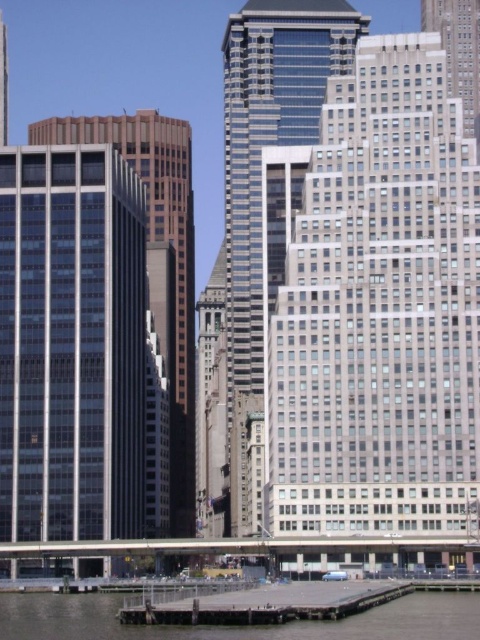
Find the location of a particular element. The image size is (480, 640). wooden dock at lower center is located at coordinates (267, 605).

Can you confirm if wooden dock at lower center is shorter than smooth brown building at left?

Yes, wooden dock at lower center is shorter than smooth brown building at left.

Image resolution: width=480 pixels, height=640 pixels. Describe the element at coordinates (267, 605) in the screenshot. I see `wooden dock at lower center` at that location.

In order to click on wooden dock at lower center in this screenshot , I will do `click(267, 605)`.

Who is higher up, glassy blue skyscraper at center or gray concrete dock at lower center?

Positioned higher is glassy blue skyscraper at center.

Is glassy blue skyscraper at center smaller than gray concrete dock at lower center?

Incorrect, glassy blue skyscraper at center is not smaller in size than gray concrete dock at lower center.

What do you see at coordinates (268, 144) in the screenshot? I see `glassy blue skyscraper at center` at bounding box center [268, 144].

You are a GUI agent. You are given a task and a screenshot of the screen. Output one action in this format:
    pyautogui.click(x=<x>, y=<y>)
    Task: Click on the glassy blue skyscraper at center
    The width and height of the screenshot is (480, 640).
    Given the screenshot: What is the action you would take?
    pyautogui.click(x=268, y=144)

Is point (29, 611) closer to viewer compared to point (267, 605)?

No, it is behind (267, 605).

Is point (75, 618) positioned after point (380, 596)?

Yes, point (75, 618) is behind point (380, 596).

This screenshot has width=480, height=640. Identify the location of gray concrete dock at lower center. (238, 627).